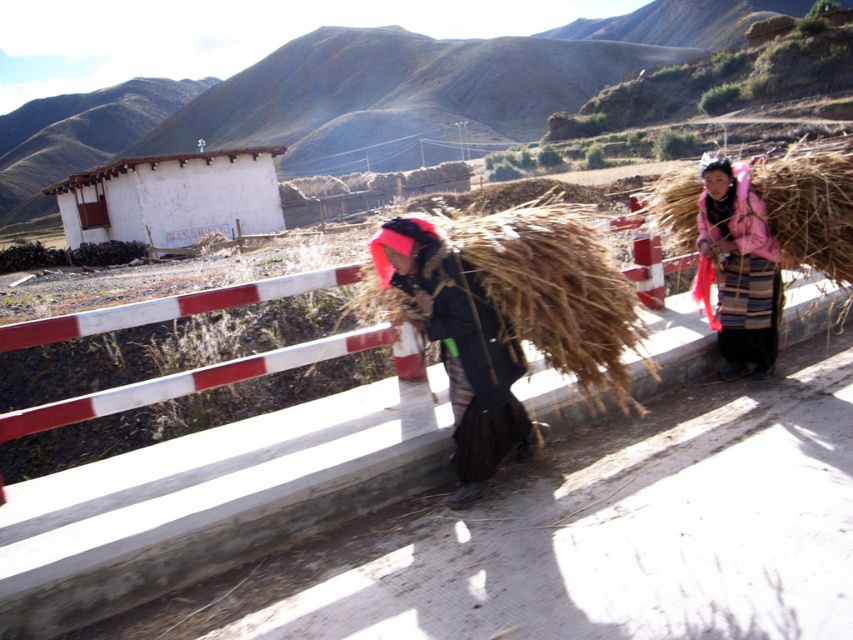
Looking at this image, you are standing on the road in the rural mountain scene and see two points marked on the ground. The first point is at coordinate point (129, 240) and the second is at point (747, 285). Which point is closer to you?

Point (129, 240) is closer to you because it is further to the viewer than point (747, 285).

In the scene shown: You are a hiker who wants to know if the brown straw at right is taller than the pink woolen jacket at right. Based on the scene, can you determine which one is taller?

The brown straw at right is shorter than the pink woolen jacket at right, so the pink woolen jacket at right is taller.